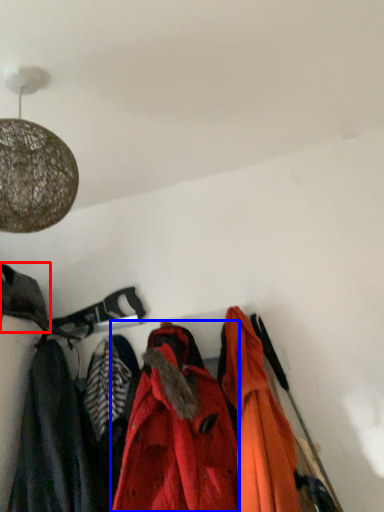
Question: Which object appears farthest to the camera in this image, cloak (highlighted by a red box) or jacket (highlighted by a blue box)?

Choices:
 (A) cloak
 (B) jacket

Answer: (A)